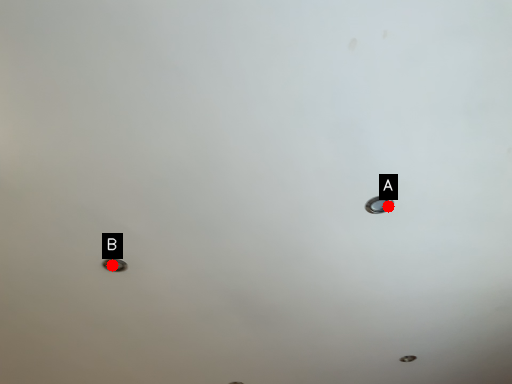
Question: Two points are circled on the image, labeled by A and B beside each circle. Which point is further to the camera?

Choices:
 (A) A is further
 (B) B is further

Answer: (B)